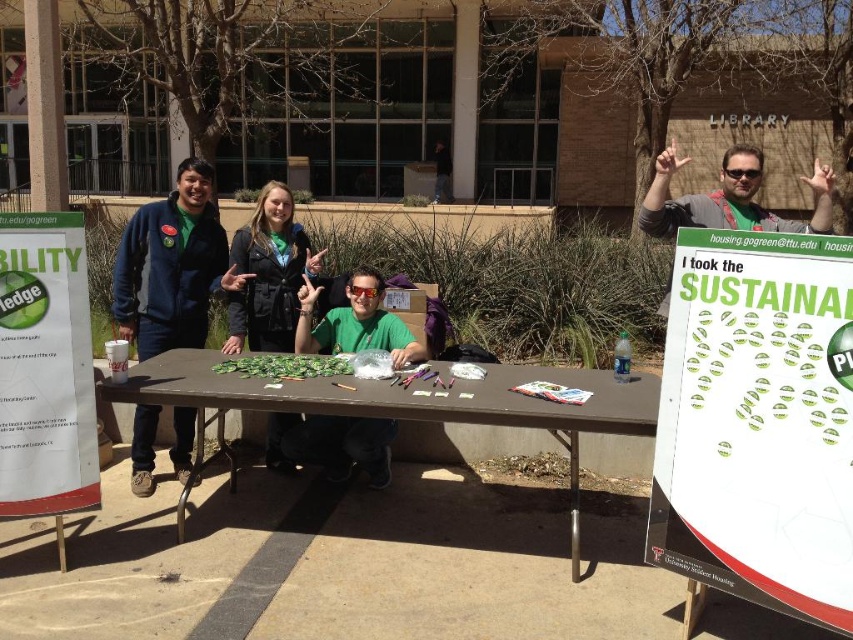
Is point (361, 381) farther from camera compared to point (250, 228)?

No.

Is brown plastic table at center smaller than green fabric jacket at center?

No, brown plastic table at center is not smaller than green fabric jacket at center.

Describe the element at coordinates (405, 403) in the screenshot. The width and height of the screenshot is (853, 640). I see `brown plastic table at center` at that location.

Where is `brown plastic table at center`? brown plastic table at center is located at coordinates (405, 403).

The width and height of the screenshot is (853, 640). What do you see at coordinates (355, 323) in the screenshot?
I see `green matte shirt at center` at bounding box center [355, 323].

Can you confirm if green matte shirt at center is bigger than green fabric jacket at center?

Correct, green matte shirt at center is larger in size than green fabric jacket at center.

Locate an element on the screen. The image size is (853, 640). green matte shirt at center is located at coordinates 355,323.

Does green fabric jacket at center appear over matte green t-shirt at upper right?

No.

Measure the distance between point (265, 465) and camera.

The distance of point (265, 465) from camera is 4.60 meters.

Between point (285, 208) and point (693, 204), which one is positioned behind?

The point (285, 208) is behind.

Find the location of `green fabric jacket at center`. green fabric jacket at center is located at coordinates 268,275.